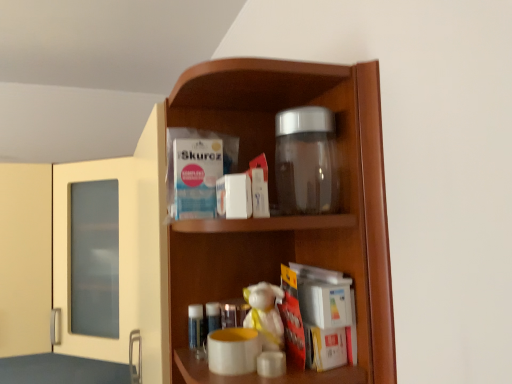
Question: Is transparent glass jar at upper center bigger than white plush toy at center?

Choices:
 (A) yes
 (B) no

Answer: (A)

Question: From a real-world perspective, is transparent glass jar at upper center located beneath white plush toy at center?

Choices:
 (A) no
 (B) yes

Answer: (A)

Question: From the image's perspective, does transparent glass jar at upper center appear lower than white plush toy at center?

Choices:
 (A) no
 (B) yes

Answer: (A)

Question: Considering the relative sizes of transparent glass jar at upper center and white plush toy at center in the image provided, is transparent glass jar at upper center thinner than white plush toy at center?

Choices:
 (A) yes
 (B) no

Answer: (B)

Question: Is transparent glass jar at upper center with white plush toy at center?

Choices:
 (A) yes
 (B) no

Answer: (B)

Question: Can you confirm if transparent glass jar at upper center is shorter than white plush toy at center?

Choices:
 (A) yes
 (B) no

Answer: (B)

Question: From a real-world perspective, does white plush toy at center sit lower than transparent glass jar at upper center?

Choices:
 (A) yes
 (B) no

Answer: (A)

Question: Is white plush toy at center far from transparent glass jar at upper center?

Choices:
 (A) yes
 (B) no

Answer: (B)

Question: Is white plush toy at center oriented away from transparent glass jar at upper center?

Choices:
 (A) no
 (B) yes

Answer: (A)

Question: Is white plush toy at center in front of transparent glass jar at upper center?

Choices:
 (A) yes
 (B) no

Answer: (B)

Question: Would you say transparent glass jar at upper center is part of white plush toy at center's contents?

Choices:
 (A) yes
 (B) no

Answer: (B)

Question: From a real-world perspective, is white plush toy at center over transparent glass jar at upper center?

Choices:
 (A) no
 (B) yes

Answer: (A)

Question: From a real-world perspective, does white plush toy at center stand above transparent glass jar at upper center?

Choices:
 (A) yes
 (B) no

Answer: (B)